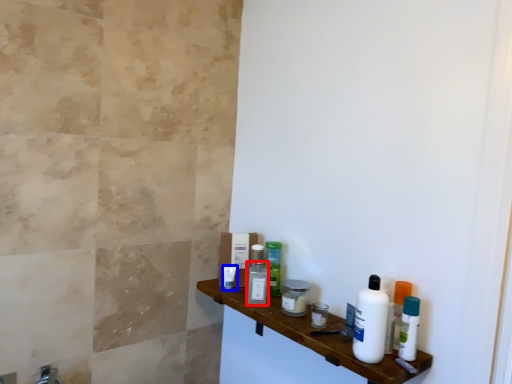
Question: Among these objects, which one is nearest to the camera, mouthwash (highlighted by a red box) or toiletry (highlighted by a blue box)?

Choices:
 (A) mouthwash
 (B) toiletry

Answer: (A)